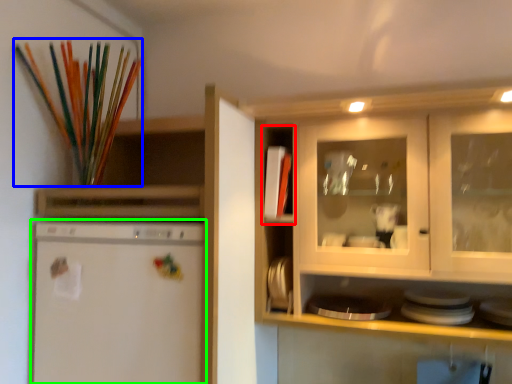
Question: Based on their relative distances, which object is nearer to cabinet (highlighted by a red box)? Choose from paint brush (highlighted by a blue box) and home appliance (highlighted by a green box).

Choices:
 (A) paint brush
 (B) home appliance

Answer: (B)